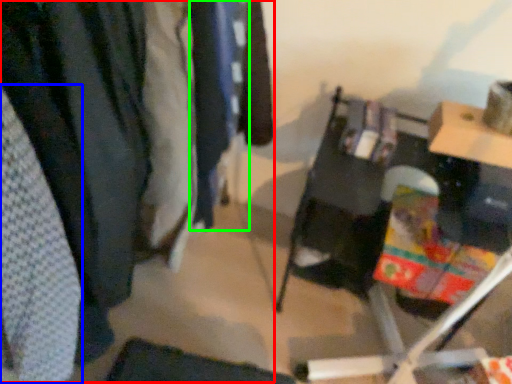
Question: Which object is the closest to the closet (highlighted by a red box)? Choose among these: clothing (highlighted by a blue box) or clothing (highlighted by a green box).

Choices:
 (A) clothing
 (B) clothing

Answer: (A)